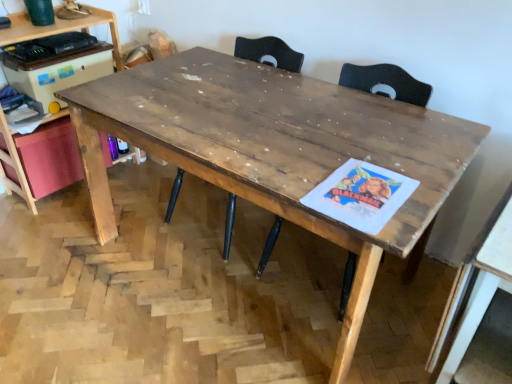
Measure the distance between wooden table at right, which is the second table from left to right, and camera.

38.70 inches.

The height and width of the screenshot is (384, 512). Find the location of `wooden swivel chair at center`. wooden swivel chair at center is located at coordinates (269, 53).

From the image's perspective, between wooden table at right, which is the second table from left to right, and wooden table at center, placed as the second table when sorted from right to left, who is located below?

wooden table at right, which is the second table from left to right.

Is wooden table at right, which is the second table from left to right, not close to wooden table at center, placed as the 1th table when sorted from left to right?

They are positioned close to each other.

From a real-world perspective, between wooden table at right, the 1th table when ordered from right to left, and wooden table at center, placed as the second table when sorted from right to left, who is vertically higher?

wooden table at center, placed as the second table when sorted from right to left.

Can you see wooden swivel chair at center touching wooden table at center, placed as the 1th table when sorted from left to right?

They are not placed beside each other.

Is wooden swivel chair at center inside or outside of wooden table at center, placed as the second table when sorted from right to left?

wooden swivel chair at center is inside wooden table at center, placed as the second table when sorted from right to left.

From the image's perspective, between wooden swivel chair at center and wooden table at center, placed as the second table when sorted from right to left, who is located below?

wooden table at center, placed as the second table when sorted from right to left.

The image size is (512, 384). What are the coordinates of `swivel chair above the wooden table at center, placed as the 1th table when sorted from left to right (from a real-world perspective)` in the screenshot? It's located at (269, 53).

Is wooden computer desk at left positioned with its back to wooden table at right, the 1th table when ordered from right to left?

No, wooden computer desk at left is not facing the opposite direction of wooden table at right, the 1th table when ordered from right to left.

Considering their positions, is wooden computer desk at left located in front of or behind wooden table at right, which is the second table from left to right?

In the image, wooden computer desk at left appears behind wooden table at right, which is the second table from left to right.

Can you tell me how much wooden computer desk at left and wooden table at right, the 1th table when ordered from right to left, differ in facing direction?

wooden computer desk at left and wooden table at right, the 1th table when ordered from right to left, are facing 90.7 degrees away from each other.

From a real-world perspective, which table is the 2nd one underneath the wooden computer desk at left? Please provide its 2D coordinates.

[(483, 289)]

Does wooden table at right, the 1th table when ordered from right to left, appear on the left side of wooden swivel chair at center?

No, wooden table at right, the 1th table when ordered from right to left, is not to the left of wooden swivel chair at center.

From the picture: Can you confirm if wooden table at right, which is the second table from left to right, is thinner than wooden swivel chair at center?

No, wooden table at right, which is the second table from left to right, is not thinner than wooden swivel chair at center.

From a real-world perspective, is wooden table at right, which is the second table from left to right, located higher than wooden swivel chair at center?

No, from a real-world perspective, wooden table at right, which is the second table from left to right, is not on top of wooden swivel chair at center.

Is wooden table at right, which is the second table from left to right, oriented away from wooden swivel chair at center?

No, wooden table at right, which is the second table from left to right, is not facing the opposite direction of wooden swivel chair at center.

How distant is wooden swivel chair at center from wooden table at right, the 1th table when ordered from right to left?

35.84 inches.

Does wooden swivel chair at center turn towards wooden table at right, which is the second table from left to right?

No, wooden swivel chair at center is not aimed at wooden table at right, which is the second table from left to right.

From the image's perspective, is wooden swivel chair at center located above or below wooden table at right, the 1th table when ordered from right to left?

Based on their image positions, wooden swivel chair at center is located above wooden table at right, the 1th table when ordered from right to left.

Does wooden swivel chair at center have a smaller size compared to wooden table at right, the 1th table when ordered from right to left?

Actually, wooden swivel chair at center might be larger than wooden table at right, the 1th table when ordered from right to left.

Would you say wooden computer desk at left contains wooden swivel chair at center?

No, wooden swivel chair at center is not a part of wooden computer desk at left.

From the image's perspective, is wooden computer desk at left below wooden swivel chair at center?

Actually, wooden computer desk at left appears above wooden swivel chair at center in the image.

Considering the relative sizes of wooden computer desk at left and wooden swivel chair at center in the image provided, is wooden computer desk at left shorter than wooden swivel chair at center?

Incorrect, the height of wooden computer desk at left does not fall short of that of wooden swivel chair at center.

Between wooden computer desk at left and wooden swivel chair at center, which one has smaller size?

wooden computer desk at left.

From the image's perspective, is wooden table at center, placed as the 1th table when sorted from left to right, positioned above or below wooden swivel chair at center?

wooden table at center, placed as the 1th table when sorted from left to right, is below wooden swivel chair at center.

From a real-world perspective, is wooden table at center, placed as the second table when sorted from right to left, positioned under wooden swivel chair at center based on gravity?

Yes, from a real-world perspective, wooden table at center, placed as the second table when sorted from right to left, is under wooden swivel chair at center.

Could you tell me if wooden table at center, placed as the 1th table when sorted from left to right, is facing wooden swivel chair at center?

Yes, wooden table at center, placed as the 1th table when sorted from left to right, is oriented towards wooden swivel chair at center.

Locate an element on the screen. This screenshot has width=512, height=384. table on the right of wooden table at center, placed as the second table when sorted from right to left is located at coordinates (483, 289).

Which table is the 1st one when counting from the front of the wooden swivel chair at center? Please provide its 2D coordinates.

[(277, 150)]

Which object lies further to the anchor point wooden computer desk at left, wooden table at right, which is the second table from left to right, or wooden table at center, placed as the 1th table when sorted from left to right?

Among the two, wooden table at right, which is the second table from left to right, is located further to wooden computer desk at left.

Based on their spatial positions, is wooden swivel chair at center or wooden computer desk at left closer to wooden table at right, the 1th table when ordered from right to left?

wooden swivel chair at center.

When comparing their distances from wooden computer desk at left, does wooden swivel chair at center or wooden table at right, the 1th table when ordered from right to left, seem closer?

wooden swivel chair at center lies closer to wooden computer desk at left than the other object.

Estimate the real-world distances between objects in this image. Which object is closer to wooden table at center, placed as the 1th table when sorted from left to right, wooden table at right, which is the second table from left to right, or wooden swivel chair at center?

Based on the image, wooden swivel chair at center appears to be nearer to wooden table at center, placed as the 1th table when sorted from left to right.

In the scene shown: Estimate the real-world distances between objects in this image. Which object is closer to wooden swivel chair at center, wooden table at center, placed as the second table when sorted from right to left, or wooden computer desk at left?

Based on the image, wooden table at center, placed as the second table when sorted from right to left, appears to be nearer to wooden swivel chair at center.

Based on their spatial positions, is wooden swivel chair at center or wooden table at center, placed as the 1th table when sorted from left to right, closer to wooden table at right, which is the second table from left to right?

Among the two, wooden table at center, placed as the 1th table when sorted from left to right, is located nearer to wooden table at right, which is the second table from left to right.

Estimate the real-world distances between objects in this image. Which object is further from wooden table at right, which is the second table from left to right, wooden computer desk at left or wooden swivel chair at center?

Among the two, wooden computer desk at left is located further to wooden table at right, which is the second table from left to right.

Based on their spatial positions, is wooden computer desk at left or wooden swivel chair at center further from wooden table at center, placed as the 1th table when sorted from left to right?

Among the two, wooden computer desk at left is located further to wooden table at center, placed as the 1th table when sorted from left to right.

This screenshot has height=384, width=512. In order to click on table between wooden swivel chair at center and wooden table at right, which is the second table from left to right, from left to right in this screenshot , I will do `click(277, 150)`.

Identify the location of swivel chair situated between wooden computer desk at left and wooden table at right, the 1th table when ordered from right to left, from left to right. The height and width of the screenshot is (384, 512). (269, 53).

Where is `swivel chair situated between wooden computer desk at left and wooden table at center, placed as the second table when sorted from right to left, from left to right`? This screenshot has height=384, width=512. swivel chair situated between wooden computer desk at left and wooden table at center, placed as the second table when sorted from right to left, from left to right is located at coordinates pos(269,53).

This screenshot has height=384, width=512. Identify the location of table situated between wooden computer desk at left and wooden table at right, the 1th table when ordered from right to left, from left to right. (277, 150).